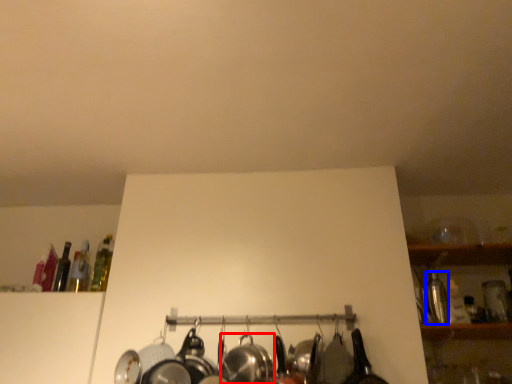
Question: Which object appears closest to the camera in this image, wok (highlighted by a red box) or bottle (highlighted by a blue box)?

Choices:
 (A) wok
 (B) bottle

Answer: (A)